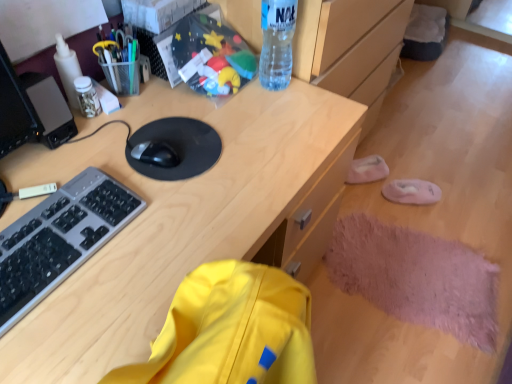
You are a GUI agent. You are given a task and a screenshot of the screen. Output one action in this format:
    pyautogui.click(x=<x>, y=<y>)
    Task: Click on the free space between black matte mouse at center and translucent plastic jar at upper left, positioned as the 1th stationery in left-to-right order
    This screenshot has width=512, height=384.
    Given the screenshot: What is the action you would take?
    pyautogui.click(x=122, y=130)